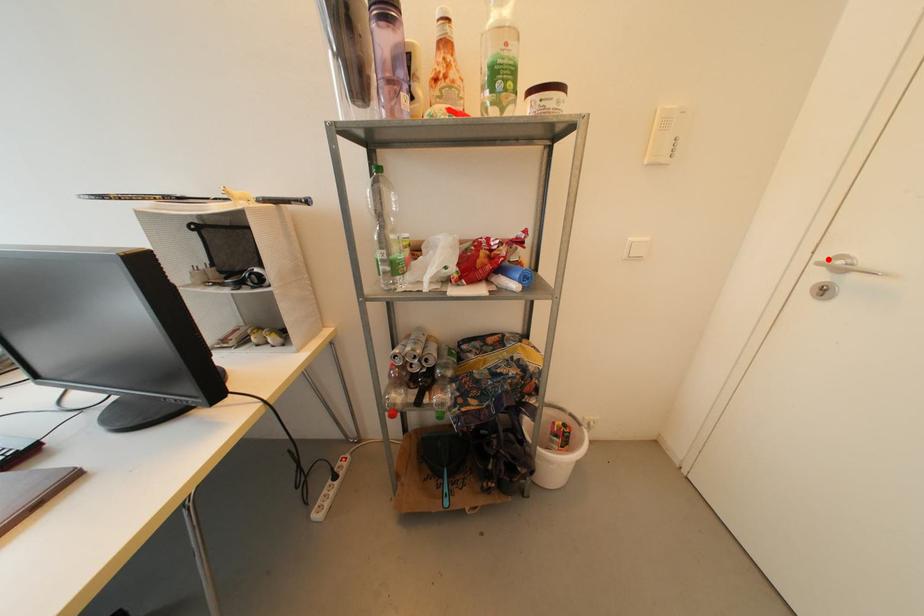
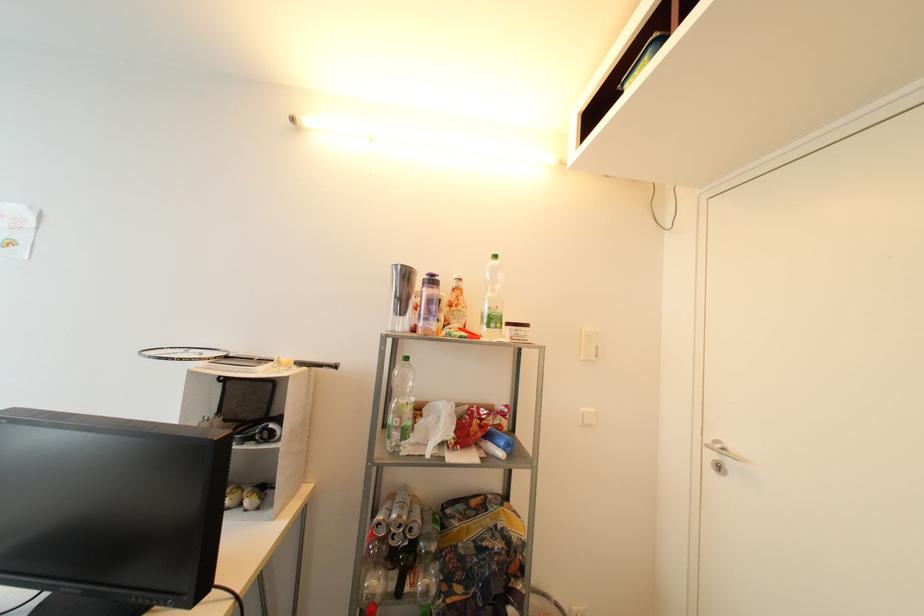
The point at the highlighted location is marked in the first image. Where is the corresponding point in the second image?

(713, 442)